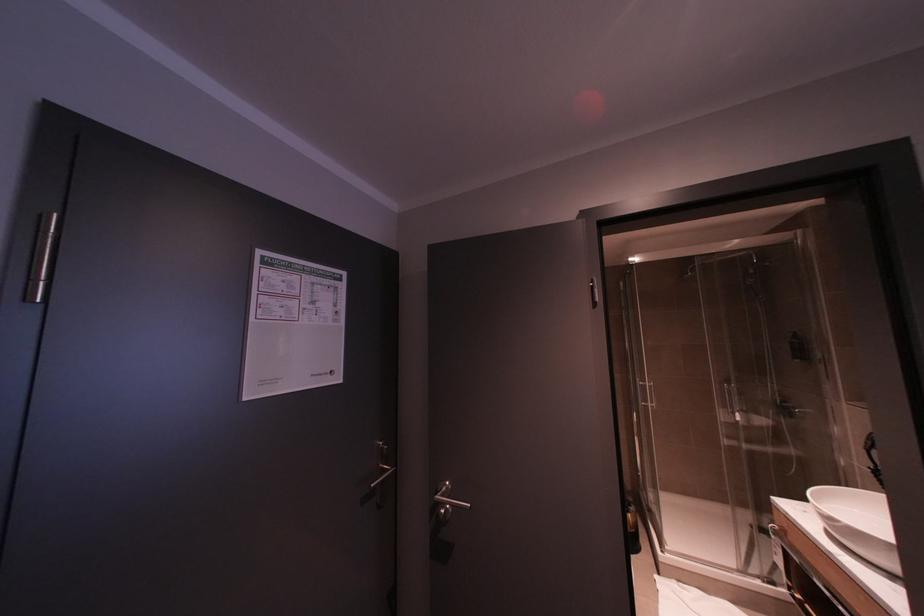
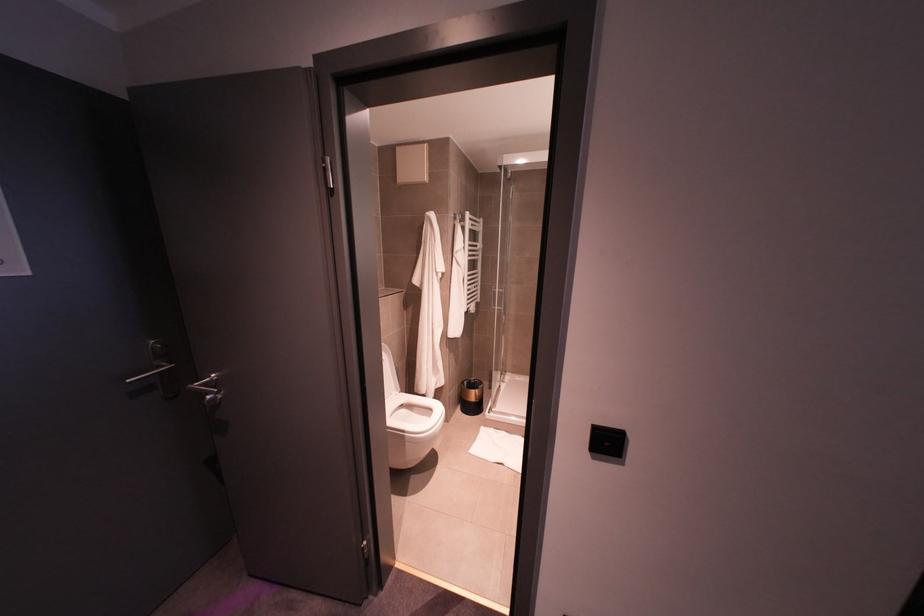
Find the pixel in the second image that matches point (645, 400) in the first image.

(494, 305)